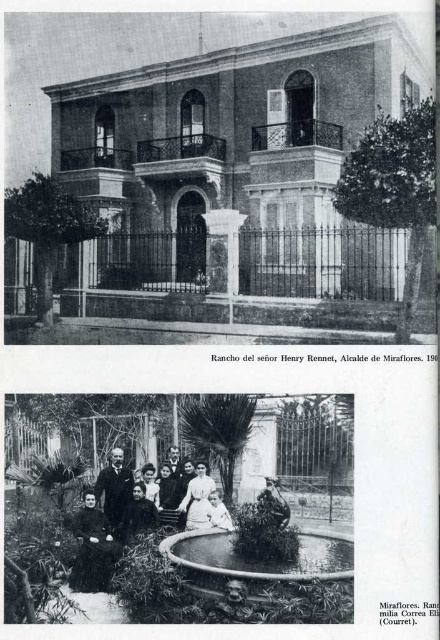
You are attending a formal event and must choose between the white cotton dress at center and the dark velvet dress at center. Based on their placement in the image, which dress is located to the right?

The white cotton dress at center is positioned on the right side of the dark velvet dress at center, so it is the dress located to the right.

You are a fashion designer who wants to display two dresses side by side in a boutique window. The boutique window has a display space that is 5 inches wide. Can both the white cotton dress at center and the dark velvet dress at center fit side by side in this space?

The white cotton dress at center is 4.70 inches from the dark velvet dress at center, so the total width required would be the sum of their individual widths plus the 4.70 inches between them. However, since the exact widths of the dresses are not provided, it is impossible to determine if they will fit within the 5 inch space.